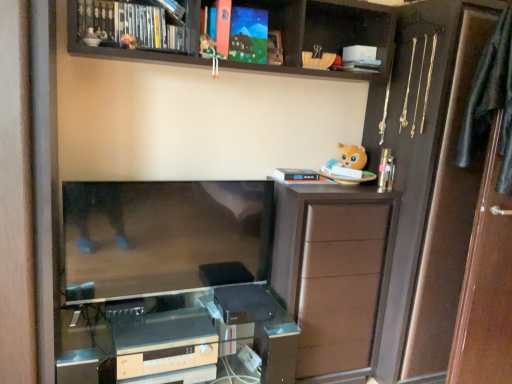
Question: Considering the positions of black plastic game console at lower center, which is counted as the 1th appliance, starting from the top, and brown matte cabinet at right in the image, is black plastic game console at lower center, which is counted as the 1th appliance, starting from the top, taller or shorter than brown matte cabinet at right?

Choices:
 (A) short
 (B) tall

Answer: (A)

Question: In terms of size, does black plastic game console at lower center, which is the first appliance from right to left, appear bigger or smaller than brown matte cabinet at right?

Choices:
 (A) big
 (B) small

Answer: (B)

Question: Which object is positioned closest to the hardcover book at upper center, the 3th book from the left?

Choices:
 (A) white matte book at upper center, arranged as the 5th book when viewed from the top
 (B) brown matte cabinet at right
 (C) black fabric robe at right
 (D) matte plastic toy at upper center, which appears as the 2th toy when viewed from the right
 (E) matte paper book at upper center, placed as the first book when sorted from top to bottom

Answer: (E)

Question: Estimate the real-world distances between objects in this image. Which object is farther from the brown matte cabinet at right?

Choices:
 (A) hardcover book at upper center, the 3th book from the left
 (B) transparent glass door at right
 (C) silver metallic stereo at lower center, positioned as the second appliance in right-to-left order
 (D) matte plastic toy at upper center, which appears as the 2th toy when viewed from the right
 (E) green felt bird at upper center, positioned as the second toy in left-to-right order

Answer: (D)